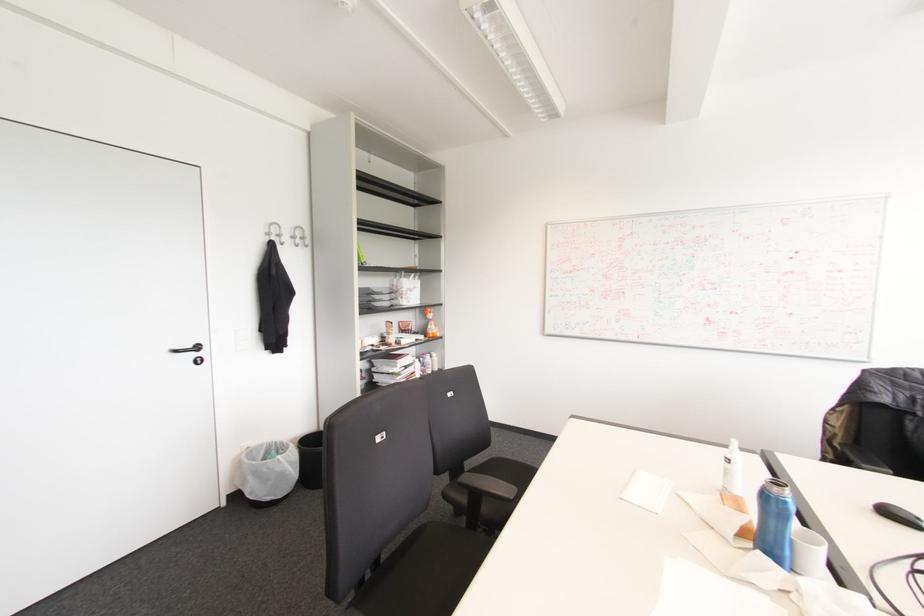
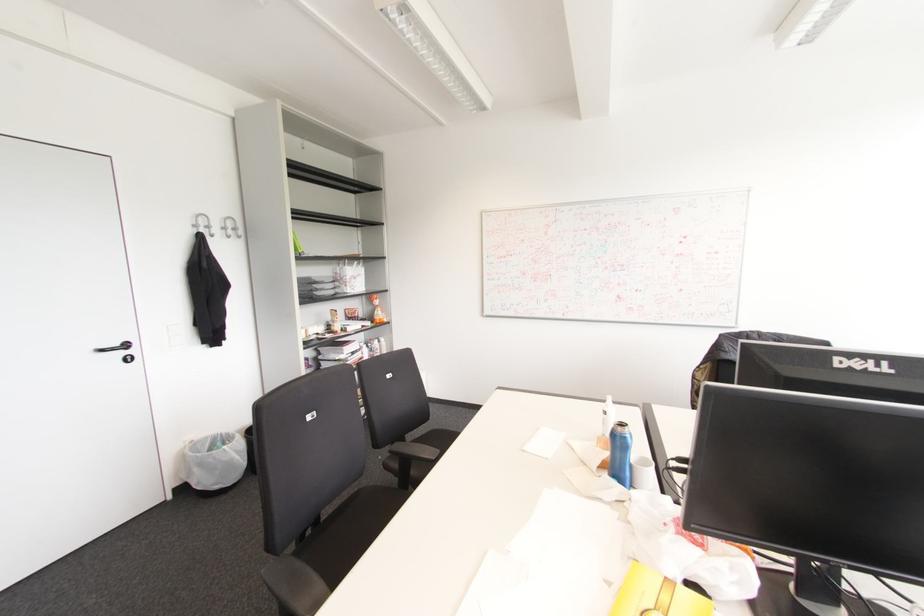
Question: I am providing you with two images of the same scene from different viewpoints. Please identify which objects are invisible in image2.

Choices:
 (A) black door handle
 (B) small trash can
 (C) blue water bottle
 (D) none of these

Answer: (D)